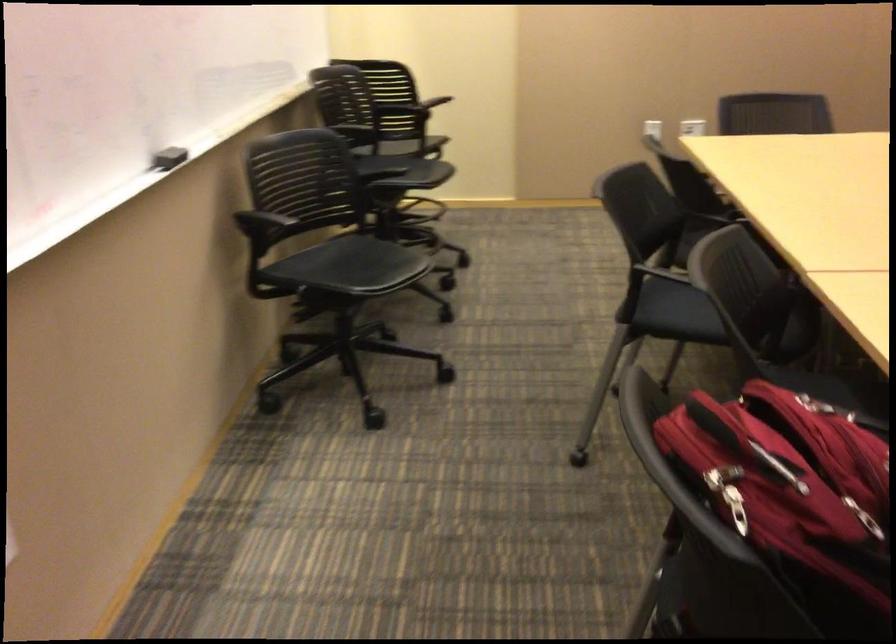
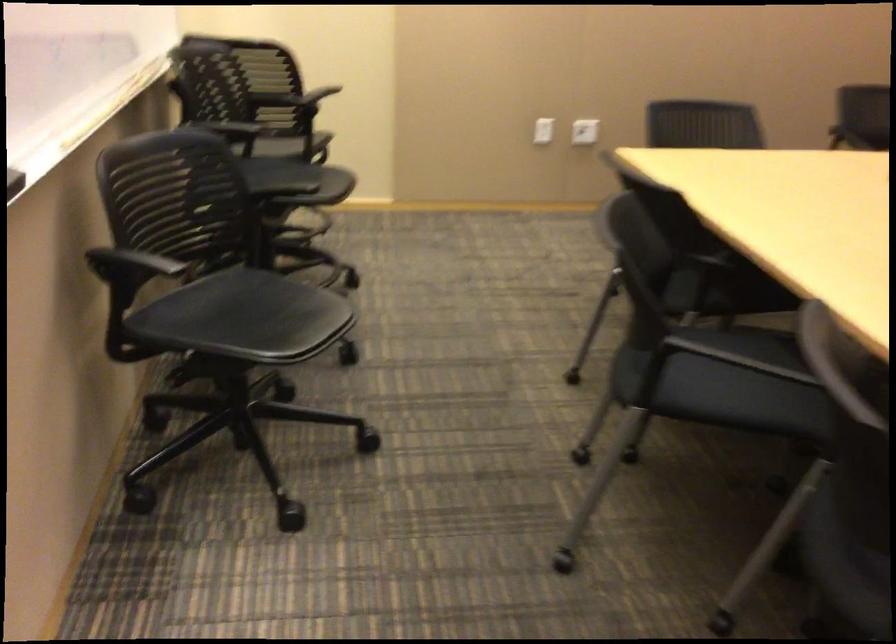
What movement of the cameraman would produce the second image?

The cameraman walked toward left, forward.